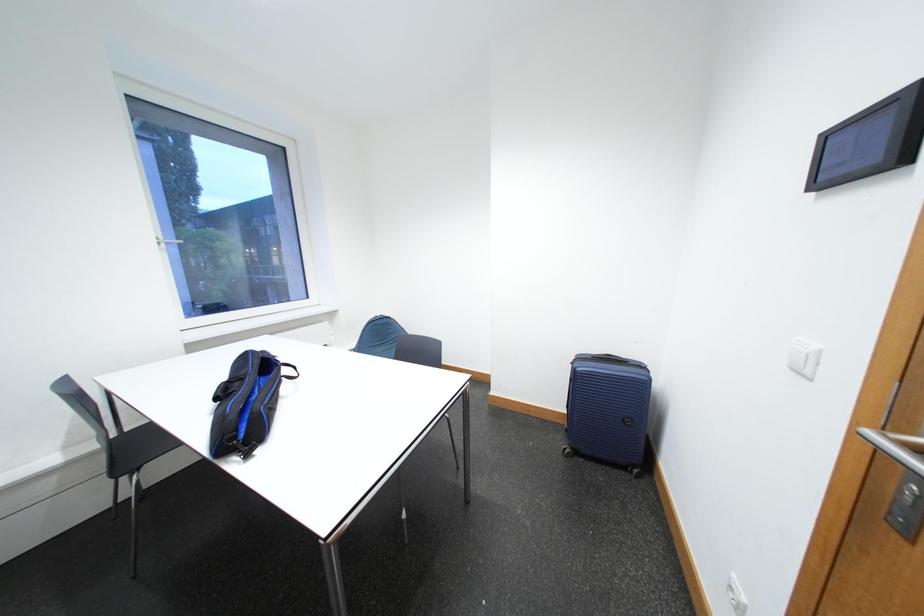
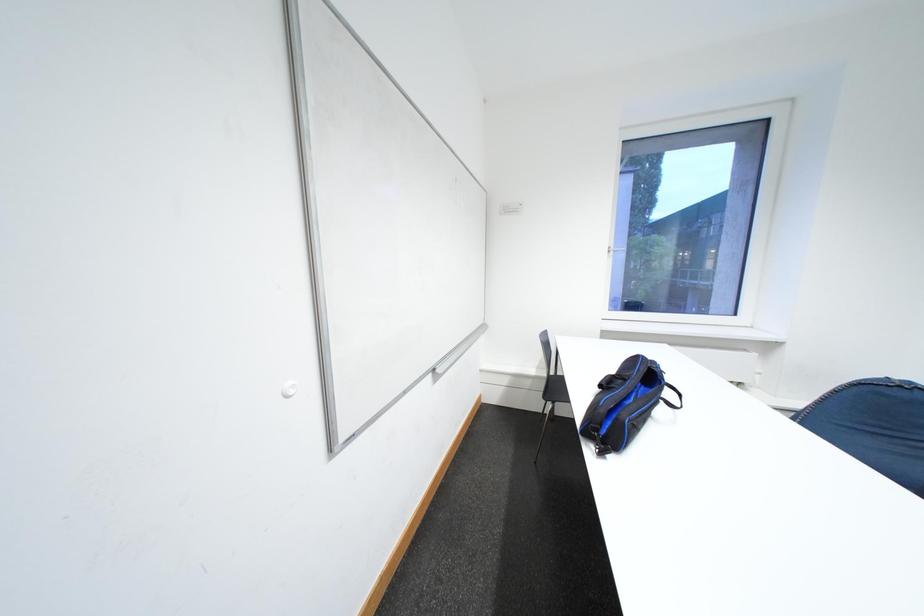
Question: How did the camera likely rotate?

Choices:
 (A) Left
 (B) Right
 (C) Up
 (D) Down

Answer: (A)